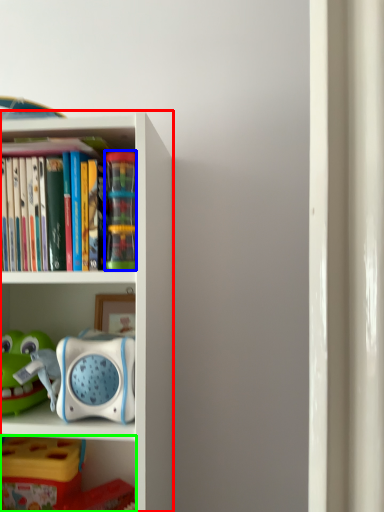
Question: Which is farther away from bookcase (highlighted by a red box)? toy (highlighted by a blue box) or shelf (highlighted by a green box)?

Choices:
 (A) toy
 (B) shelf

Answer: (B)